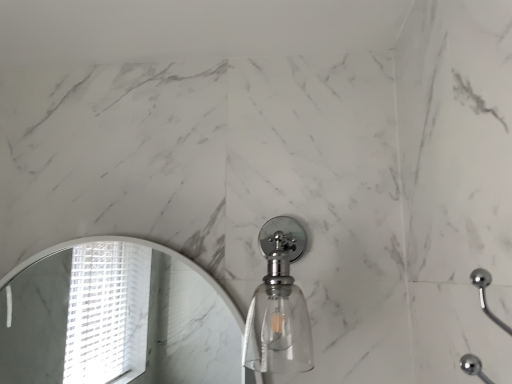
What do you see at coordinates (279, 306) in the screenshot? Image resolution: width=512 pixels, height=384 pixels. I see `clear glass soap dispenser at center` at bounding box center [279, 306].

At what (x,y) coordinates should I click in order to perform the action: click on clear glass soap dispenser at center. Please return your answer as a coordinate pair (x, y). Looking at the image, I should click on (279, 306).

From the picture: In order to face clear glass soap dispenser at center, should I rotate leftwards or rightwards?

To align with it, rotate right about 3.816°.

The height and width of the screenshot is (384, 512). What do you see at coordinates (115, 321) in the screenshot? I see `white marble mirror at upper left` at bounding box center [115, 321].

Locate an element on the screen. white marble mirror at upper left is located at coordinates (115, 321).

Locate an element on the screen. clear glass soap dispenser at center is located at coordinates (279, 306).

Does white marble mirror at upper left appear on the right side of clear glass soap dispenser at center?

No.

Relative to clear glass soap dispenser at center, is white marble mirror at upper left in front or behind?

white marble mirror at upper left is positioned farther from the viewer than clear glass soap dispenser at center.

Which is less distant, (137, 291) or (298, 360)?

Point (137, 291) is farther from the camera than point (298, 360).

From the image's perspective, is white marble mirror at upper left below clear glass soap dispenser at center?

Yes, from the image's perspective, white marble mirror at upper left is beneath clear glass soap dispenser at center.

From a real-world perspective, is white marble mirror at upper left physically below clear glass soap dispenser at center?

Indeed, from a real-world perspective, white marble mirror at upper left is positioned beneath clear glass soap dispenser at center.

Can you confirm if white marble mirror at upper left is thinner than clear glass soap dispenser at center?

Yes, white marble mirror at upper left is thinner than clear glass soap dispenser at center.

Considering the sizes of objects white marble mirror at upper left and clear glass soap dispenser at center in the image provided, who is shorter, white marble mirror at upper left or clear glass soap dispenser at center?

With less height is clear glass soap dispenser at center.

Considering the relative sizes of white marble mirror at upper left and clear glass soap dispenser at center in the image provided, is white marble mirror at upper left bigger than clear glass soap dispenser at center?

No.

Is white marble mirror at upper left not inside clear glass soap dispenser at center?

Yes, white marble mirror at upper left is outside of clear glass soap dispenser at center.

Is white marble mirror at upper left in contact with clear glass soap dispenser at center?

They are not placed beside each other.

Is white marble mirror at upper left facing away from clear glass soap dispenser at center?

No, clear glass soap dispenser at center is not at the back of white marble mirror at upper left.

What's the angular difference between white marble mirror at upper left and clear glass soap dispenser at center's facing directions?

They differ by 1.65 degrees in their facing directions.

Measure the distance between white marble mirror at upper left and clear glass soap dispenser at center.

white marble mirror at upper left and clear glass soap dispenser at center are 1.75 meters apart.

This screenshot has height=384, width=512. In the image, there is a white marble mirror at upper left. Identify the location of soap dispenser above it (from the image's perspective). (279, 306).

Considering the positions of objects clear glass soap dispenser at center and white marble mirror at upper left in the image provided, who is more to the right, clear glass soap dispenser at center or white marble mirror at upper left?

From the viewer's perspective, clear glass soap dispenser at center appears more on the right side.

Based on the photo, which is in front, clear glass soap dispenser at center or white marble mirror at upper left?

clear glass soap dispenser at center is closer to the camera.

Which is nearer, (272,239) or (211,317)?

Point (272,239) appears to be closer to the viewer than point (211,317).

From the image's perspective, is clear glass soap dispenser at center located beneath white marble mirror at upper left?

No, from the image's perspective, clear glass soap dispenser at center is not beneath white marble mirror at upper left.

From a real-world perspective, relative to white marble mirror at upper left, is clear glass soap dispenser at center vertically above or below?

Clearly, from a real-world perspective, clear glass soap dispenser at center is above white marble mirror at upper left.

Considering the sizes of clear glass soap dispenser at center and white marble mirror at upper left in the image, is clear glass soap dispenser at center wider or thinner than white marble mirror at upper left?

In the image, clear glass soap dispenser at center appears to be wider than white marble mirror at upper left.

In the scene shown: Does clear glass soap dispenser at center have a greater height compared to white marble mirror at upper left?

No.

Who is bigger, clear glass soap dispenser at center or white marble mirror at upper left?

clear glass soap dispenser at center is bigger.

Is clear glass soap dispenser at center inside the boundaries of white marble mirror at upper left, or outside?

clear glass soap dispenser at center is located beyond the bounds of white marble mirror at upper left.

Is clear glass soap dispenser at center far away from white marble mirror at upper left?

clear glass soap dispenser at center is far away from white marble mirror at upper left.

Does clear glass soap dispenser at center turn towards white marble mirror at upper left?

No, clear glass soap dispenser at center does not turn towards white marble mirror at upper left.

How far apart are clear glass soap dispenser at center and white marble mirror at upper left?

clear glass soap dispenser at center is 5.75 feet from white marble mirror at upper left.

This screenshot has height=384, width=512. I want to click on mirror below the clear glass soap dispenser at center (from the image's perspective), so click(115, 321).

I want to click on mirror below the clear glass soap dispenser at center (from the image's perspective), so click(x=115, y=321).

Locate an element on the screen. Image resolution: width=512 pixels, height=384 pixels. soap dispenser that is above the white marble mirror at upper left (from a real-world perspective) is located at coordinates 279,306.